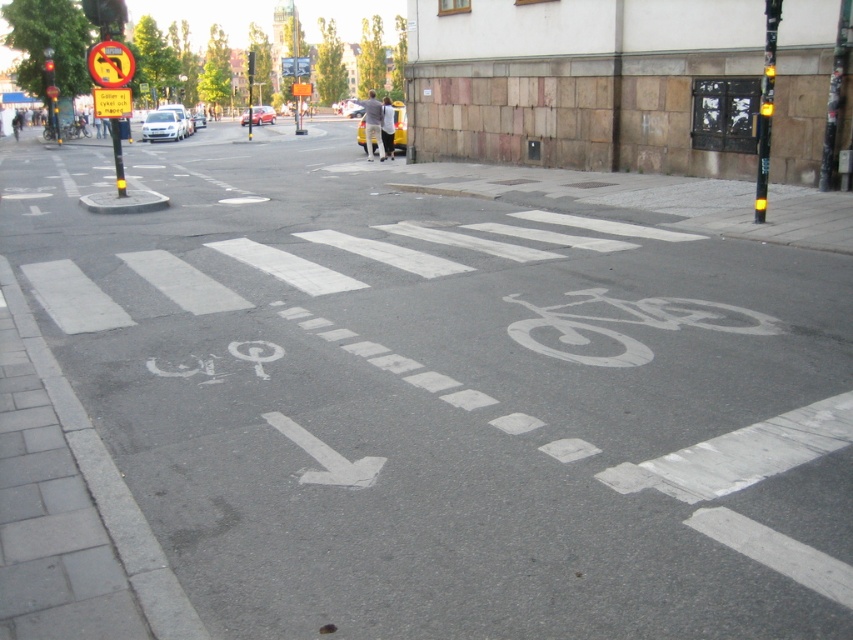
Question: Is red glass traffic light at upper left in front of silver metallic sedan at center?

Choices:
 (A) no
 (B) yes

Answer: (B)

Question: Which object appears farthest from the camera in this image?

Choices:
 (A) white painted bike lane at lower left
 (B) yellow reflective circular sign at upper left

Answer: (B)

Question: Is red glass traffic light at upper left closer to camera compared to metallic traffic light at upper center?

Choices:
 (A) no
 (B) yes

Answer: (B)

Question: Which is nearer to the white painted bike lane at lower left?

Choices:
 (A) metallic silver car at center
 (B) metallic reflective sign at upper center
 (C) yellow matte car at center

Answer: (C)

Question: Is the position of yellow matte car at center more distant than that of metallic silver car at center?

Choices:
 (A) no
 (B) yes

Answer: (A)

Question: Which point is farther to the camera?

Choices:
 (A) yellow reflective circular sign at upper left
 (B) white painted bike lane at lower left
 (C) white glossy car at center-left
 (D) yellow matte car at center

Answer: (C)